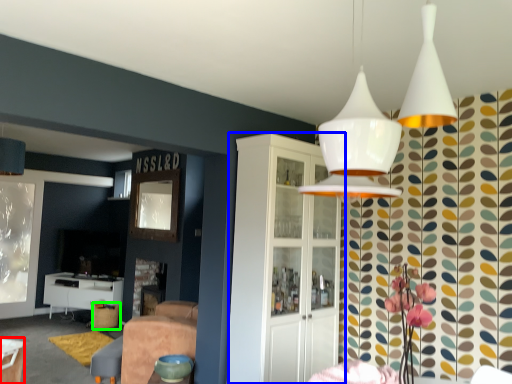
Question: Estimate the real-world distances between objects in this image. Which object is closer to table (highlighted by a red box), cabinetry (highlighted by a blue box) or bar stool (highlighted by a green box)?

Choices:
 (A) cabinetry
 (B) bar stool

Answer: (A)